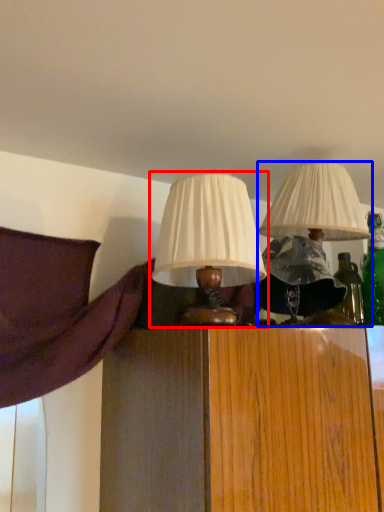
Question: Which object appears closest to the camera in this image, lamp (highlighted by a red box) or lamp (highlighted by a blue box)?

Choices:
 (A) lamp
 (B) lamp

Answer: (A)